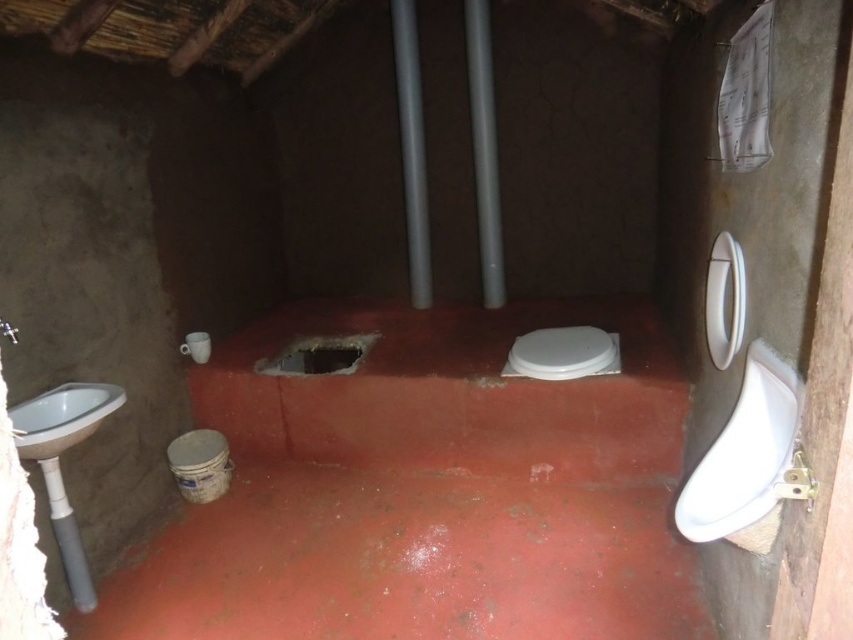
Can you confirm if smooth concrete floor at center is positioned to the left of white glossy toilet bowl at center?

Yes, smooth concrete floor at center is to the left of white glossy toilet bowl at center.

Between smooth concrete floor at center and white glossy toilet bowl at center, which one is positioned higher?

white glossy toilet bowl at center is higher up.

Find the location of a particular element. smooth concrete floor at center is located at coordinates (424, 486).

The image size is (853, 640). What are the coordinates of `smooth concrete floor at center` in the screenshot? It's located at (424, 486).

Can you confirm if smooth concrete floor at center is wider than white glossy sink at left?

Indeed, smooth concrete floor at center has a greater width compared to white glossy sink at left.

Describe the element at coordinates (424, 486) in the screenshot. I see `smooth concrete floor at center` at that location.

At what (x,y) coordinates should I click in order to perform the action: click on smooth concrete floor at center. Please return your answer as a coordinate pair (x, y). The height and width of the screenshot is (640, 853). Looking at the image, I should click on (424, 486).

Is white glossy sink at left behind white glossy toilet bowl at center?

No, white glossy sink at left is closer to the viewer.

Measure the distance from white glossy sink at left to white glossy toilet bowl at center.

The distance of white glossy sink at left from white glossy toilet bowl at center is 1.84 meters.

Who is more forward, (x=77, y=406) or (x=540, y=337)?

Point (x=77, y=406) is more forward.

Where is `white glossy sink at left`? The height and width of the screenshot is (640, 853). white glossy sink at left is located at coordinates (61, 417).